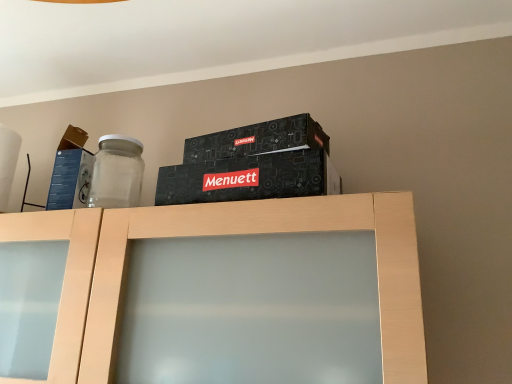
The height and width of the screenshot is (384, 512). What do you see at coordinates (214, 235) in the screenshot? I see `light wood cabinet at center` at bounding box center [214, 235].

What is the approximate width of light wood cabinet at center?

The width of light wood cabinet at center is 11.18 inches.

Identify the location of light wood cabinet at center. click(x=214, y=235).

Measure the distance between point [271,208] and camera.

77.20 centimeters.

This screenshot has height=384, width=512. I want to click on blue cardboard box at left, so click(x=71, y=172).

The image size is (512, 384). Describe the element at coordinates (71, 172) in the screenshot. I see `blue cardboard box at left` at that location.

The height and width of the screenshot is (384, 512). What are the coordinates of `light wood cabinet at center` in the screenshot? It's located at (214, 235).

Can you confirm if light wood cabinet at center is positioned to the left of blue cardboard box at left?

No.

In the image, is light wood cabinet at center positioned in front of or behind blue cardboard box at left?

Clearly, light wood cabinet at center is in front of blue cardboard box at left.

Which point is more forward, (84, 297) or (57, 191)?

The point (84, 297) is closer.

In the scene shown: From the image's perspective, is light wood cabinet at center located above or below blue cardboard box at left?

From the image's perspective, light wood cabinet at center appears below blue cardboard box at left.

From a real-world perspective, is light wood cabinet at center positioned under blue cardboard box at left based on gravity?

Yes, from a real-world perspective, light wood cabinet at center is under blue cardboard box at left.

Which object is thinner, light wood cabinet at center or blue cardboard box at left?

blue cardboard box at left.

Between light wood cabinet at center and blue cardboard box at left, which one has less height?

blue cardboard box at left is shorter.

Can you confirm if light wood cabinet at center is bigger than blue cardboard box at left?

Yes, light wood cabinet at center is bigger than blue cardboard box at left.

Is light wood cabinet at center situated inside blue cardboard box at left or outside?

The correct answer is: outside.

Can you see light wood cabinet at center touching blue cardboard box at left?

light wood cabinet at center is not next to blue cardboard box at left, and they're not touching.

Does light wood cabinet at center turn towards blue cardboard box at left?

No.

What's the angular difference between light wood cabinet at center and blue cardboard box at left's facing directions?

There is a 0.00239-degree angle between the facing directions of light wood cabinet at center and blue cardboard box at left.

Locate an element on the screen. This screenshot has height=384, width=512. cabinetry below the blue cardboard box at left (from the image's perspective) is located at coordinates (214, 235).

Is blue cardboard box at left to the right of light wood cabinet at center from the viewer's perspective?

No.

In the scene shown: Relative to light wood cabinet at center, is blue cardboard box at left in front or behind?

In the image, blue cardboard box at left appears behind light wood cabinet at center.

Is point (64, 139) behind point (103, 232)?

Yes, point (64, 139) is behind point (103, 232).

From the image's perspective, which is below, blue cardboard box at left or light wood cabinet at center?

light wood cabinet at center, from the image's perspective.

From the picture: From a real-world perspective, is blue cardboard box at left positioned above or below light wood cabinet at center?

blue cardboard box at left is situated higher than light wood cabinet at center in the real world.

Can you confirm if blue cardboard box at left is wider than light wood cabinet at center?

Incorrect, the width of blue cardboard box at left does not surpass that of light wood cabinet at center.

Does blue cardboard box at left have a lesser height compared to light wood cabinet at center?

Yes.

Is blue cardboard box at left bigger or smaller than light wood cabinet at center?

In the image, blue cardboard box at left appears to be smaller than light wood cabinet at center.

Choose the correct answer: Is blue cardboard box at left inside light wood cabinet at center or outside it?

blue cardboard box at left is spatially situated outside light wood cabinet at center.

Is blue cardboard box at left with light wood cabinet at center?

No, blue cardboard box at left is not in contact with light wood cabinet at center.

Could you tell me if blue cardboard box at left is facing light wood cabinet at center?

No, blue cardboard box at left is not facing towards light wood cabinet at center.

What's the angular difference between blue cardboard box at left and light wood cabinet at center's facing directions?

There is a 0.00239-degree angle between the facing directions of blue cardboard box at left and light wood cabinet at center.

Measure the distance between blue cardboard box at left and light wood cabinet at center.

blue cardboard box at left is 11.16 inches away from light wood cabinet at center.

In order to click on cabinetry lying in front of the blue cardboard box at left in this screenshot , I will do `click(214, 235)`.

Where is `box located on the left of light wood cabinet at center`? The image size is (512, 384). box located on the left of light wood cabinet at center is located at coordinates click(x=71, y=172).

In the image, there is a blue cardboard box at left. Where is `cabinetry below it (from a real-world perspective)`? The width and height of the screenshot is (512, 384). cabinetry below it (from a real-world perspective) is located at coordinates (214, 235).